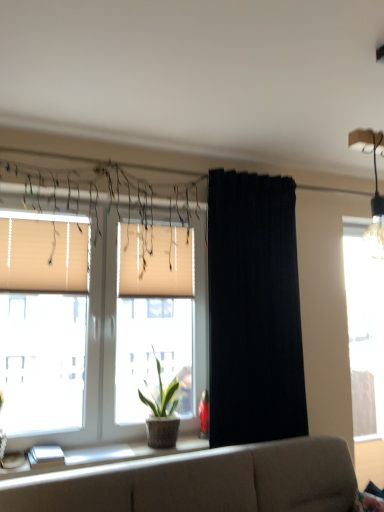
Where is `free space above white pleated blinds at center, acting as the first window blind starting from the right (from a real-world perspective)`? The height and width of the screenshot is (512, 384). free space above white pleated blinds at center, acting as the first window blind starting from the right (from a real-world perspective) is located at coordinates (158, 223).